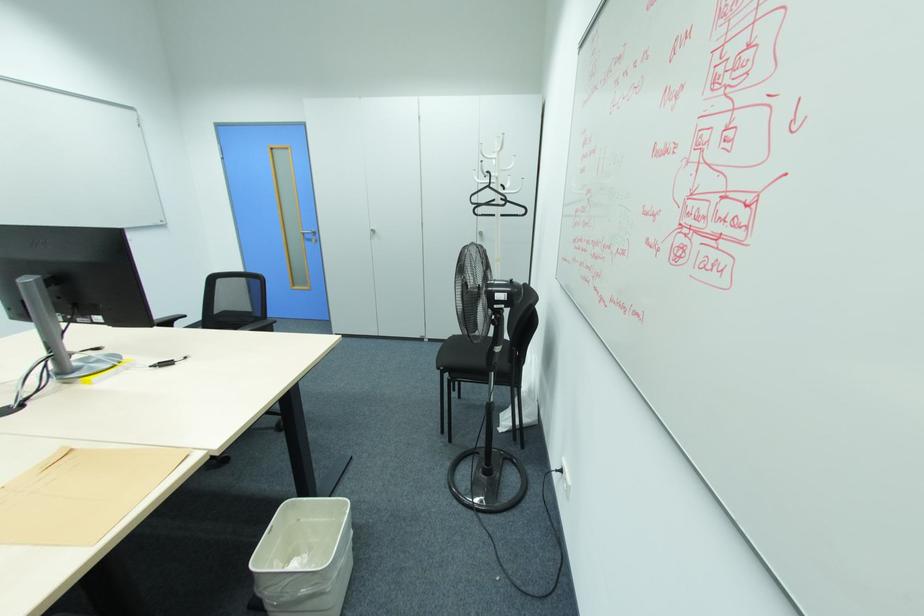
This screenshot has height=616, width=924. Describe the element at coordinates (494, 168) in the screenshot. I see `the white coat rack hook` at that location.